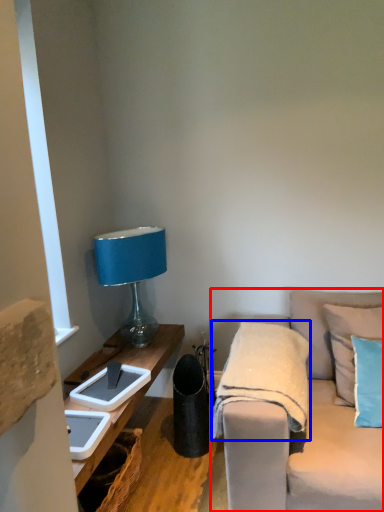
Question: Among these objects, which one is farthest to the camera, studio couch (highlighted by a red box) or blanket (highlighted by a blue box)?

Choices:
 (A) studio couch
 (B) blanket

Answer: (B)